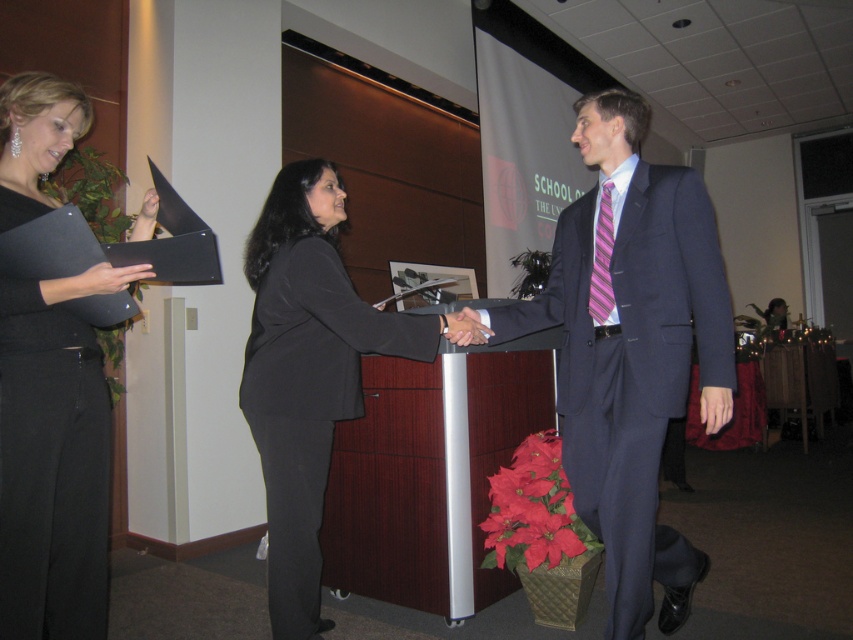
Question: Can you confirm if black matte folder at left is bigger than pink striped tie at center?

Choices:
 (A) yes
 (B) no

Answer: (A)

Question: Among these points, which one is farthest from the camera?

Choices:
 (A) (38, 189)
 (B) (386, 474)

Answer: (B)

Question: Among these objects, which one is farthest from the camera?

Choices:
 (A) black matte suit at center
 (B) matte black folder at left
 (C) pink striped tie at center

Answer: (C)

Question: Does black matte suit at center have a larger size compared to matte black hand at center?

Choices:
 (A) no
 (B) yes

Answer: (B)

Question: Is black matte suit at center below pink striped tie at center?

Choices:
 (A) no
 (B) yes

Answer: (B)

Question: Among these points, which one is farthest from the camera?

Choices:
 (A) (647, 326)
 (B) (94, 275)

Answer: (A)